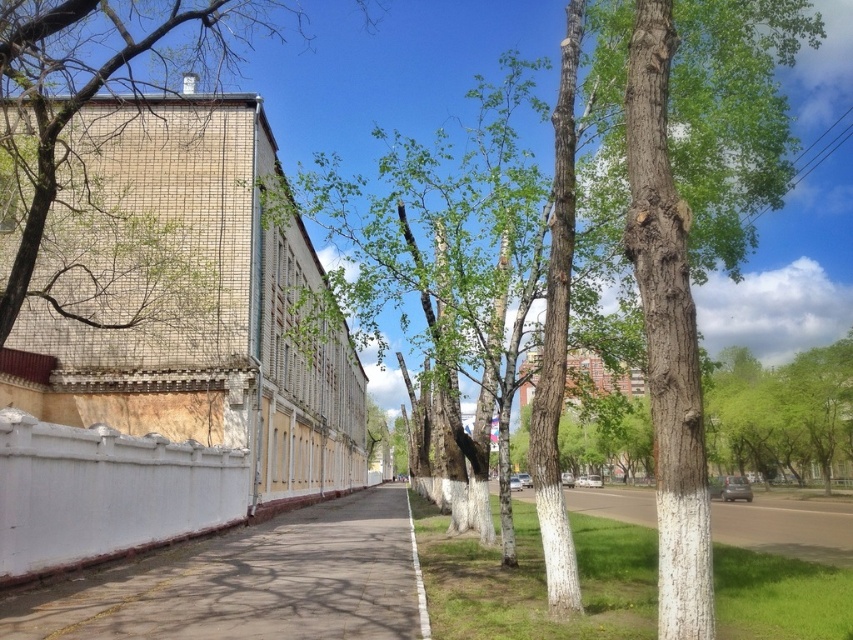
You are a gardener who needs to trim the green grass at lower center so it doesn not block the view of the white smooth fence at lower left. Can you achieve this goal?

The white smooth fence at lower left is shorter than green grass at lower center, so trimming the green grass at lower center to a shorter height would allow the fence to be visible again.

You are a gardener trying to water the green grass at lower center. There is a white concrete pavement at center in the way. Can you reach the grass without stepping on the pavement?

The white concrete pavement at center is positioned over green grass at lower center, so you cannot reach the grass without stepping on the pavement.